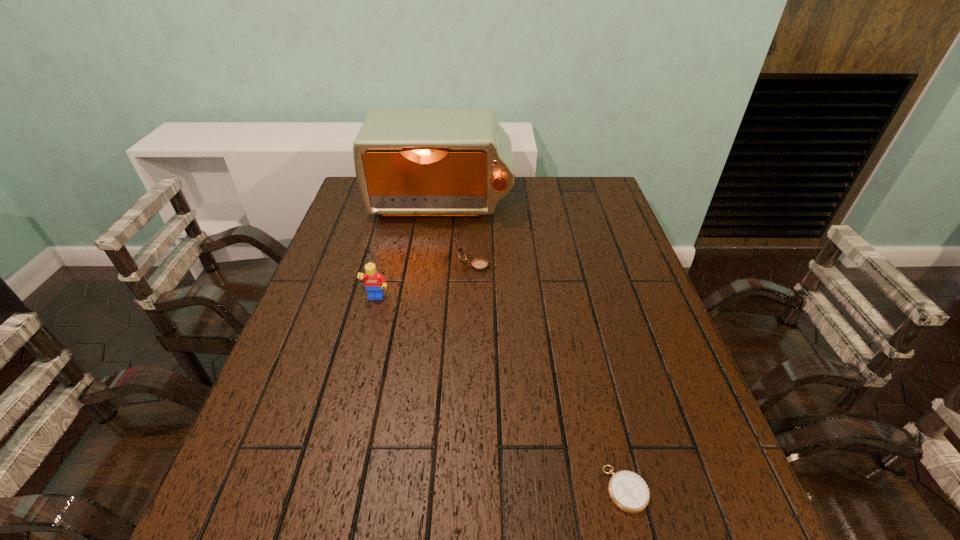
At what (x,y) coordinates should I click in order to perform the action: click on vacant space at the far right corner of the desktop. Please return your answer as a coordinate pair (x, y). The height and width of the screenshot is (540, 960). Looking at the image, I should click on (599, 202).

Find the location of a particular element. The image size is (960, 540). blank region between the nearest object and the tallest object is located at coordinates (534, 347).

Where is `free space between the second nearest object and the shortest object`? The image size is (960, 540). free space between the second nearest object and the shortest object is located at coordinates (501, 394).

Where is `free space between the shorter compass and the tallest object`? free space between the shorter compass and the tallest object is located at coordinates 534,347.

You are a GUI agent. You are given a task and a screenshot of the screen. Output one action in this format:
    pyautogui.click(x=<x>, y=<y>)
    Task: Click on the free space between the second nearest object and the tallest object
    The height and width of the screenshot is (540, 960).
    Given the screenshot: What is the action you would take?
    pyautogui.click(x=409, y=252)

At what (x,y) coordinates should I click in order to perform the action: click on free space between the right compass and the second shortest object. Please return your answer as a coordinate pair (x, y). This screenshot has height=540, width=960. Looking at the image, I should click on (551, 377).

In order to click on free space that is in between the third farthest object and the rightmost object in this screenshot , I will do `click(501, 394)`.

Where is `free space between the tallest object and the right compass`? free space between the tallest object and the right compass is located at coordinates (534, 347).

Image resolution: width=960 pixels, height=540 pixels. In order to click on empty space between the tallest object and the second tallest object in this screenshot , I will do pyautogui.click(x=409, y=252).

Where is `empty location between the shortest object and the toaster oven`? Image resolution: width=960 pixels, height=540 pixels. empty location between the shortest object and the toaster oven is located at coordinates (534, 347).